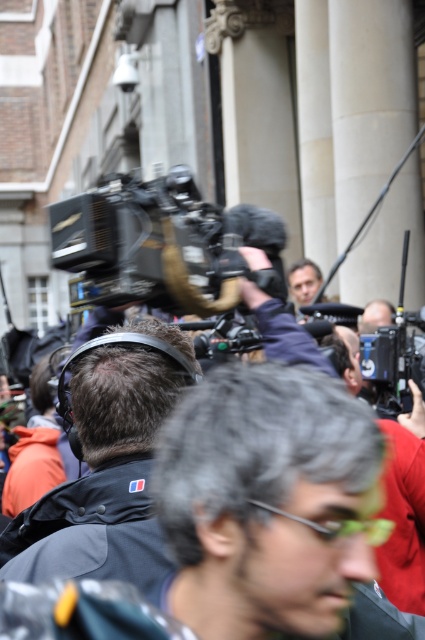
Can you confirm if black plastic video camera at center is positioned below dark gray fabric headphones at center?

No.

Who is more distant from viewer, (277, 292) or (121, 461)?

Positioned behind is point (277, 292).

You are a GUI agent. You are given a task and a screenshot of the screen. Output one action in this format:
    pyautogui.click(x=<x>, y=<y>)
    Task: Click on the black plastic video camera at center
    The width and height of the screenshot is (425, 640).
    Given the screenshot: What is the action you would take?
    pyautogui.click(x=161, y=244)

How distant is dark gray fabric headphones at center from matte black camera at center?

dark gray fabric headphones at center is 98.52 feet from matte black camera at center.

The image size is (425, 640). Identify the location of dark gray fabric headphones at center. (105, 442).

Can you confirm if black plastic video camera at center is positioned to the left of matte black camera at center?

Indeed, black plastic video camera at center is positioned on the left side of matte black camera at center.

Who is taller, black plastic video camera at center or matte black camera at center?

black plastic video camera at center is taller.

Is point (181, 227) more distant than point (302, 275)?

That is False.

Where is `black plastic video camera at center`? This screenshot has width=425, height=640. black plastic video camera at center is located at coordinates (161, 244).